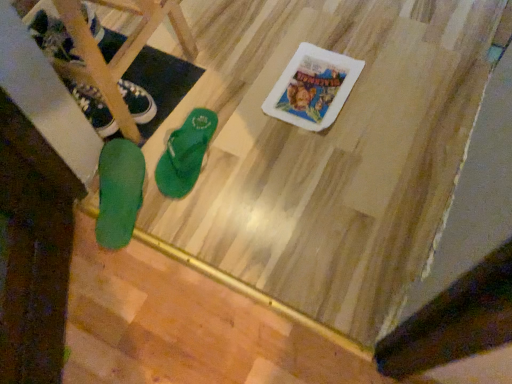
Question: Is green rubber flip-flop at lower left, the second footwear when ordered from right to left, turned away from green rubber flip-flop at lower left, which appears as the first footwear when viewed from the left?

Choices:
 (A) no
 (B) yes

Answer: (A)

Question: From the image's perspective, is green rubber flip-flop at lower left, the second footwear when ordered from right to left, over green rubber flip-flop at lower left, which appears as the first footwear when viewed from the left?

Choices:
 (A) no
 (B) yes

Answer: (A)

Question: Could you tell me if green rubber flip-flop at lower left, the 2th footwear positioned from the left, is facing green rubber flip-flop at lower left, which appears as the first footwear when viewed from the left?

Choices:
 (A) yes
 (B) no

Answer: (A)

Question: Is green rubber flip-flop at lower left, the 2th footwear positioned from the left, behind green rubber flip-flop at lower left, which appears as the first footwear when viewed from the left?

Choices:
 (A) yes
 (B) no

Answer: (B)

Question: Does green rubber flip-flop at lower left, the 2th footwear positioned from the left, come in front of green rubber flip-flop at lower left, which appears as the first footwear when viewed from the left?

Choices:
 (A) no
 (B) yes

Answer: (B)

Question: From a real-world perspective, is green rubber flip-flop at lower left, the 2th footwear positioned from the left, above or below green rubber flip-flop at center, marked as the first footwear in a right-to-left arrangement?

Choices:
 (A) below
 (B) above

Answer: (B)

Question: In terms of width, does green rubber flip-flop at lower left, the 2th footwear positioned from the left, look wider or thinner when compared to green rubber flip-flop at center, the third footwear from the left?

Choices:
 (A) thin
 (B) wide

Answer: (B)

Question: In terms of size, does green rubber flip-flop at lower left, the 2th footwear positioned from the left, appear bigger or smaller than green rubber flip-flop at center, the third footwear from the left?

Choices:
 (A) small
 (B) big

Answer: (B)

Question: Is point (128, 175) positioned closer to the camera than point (205, 145)?

Choices:
 (A) farther
 (B) closer

Answer: (B)

Question: Considering the positions of green rubber flip-flop at center, marked as the first footwear in a right-to-left arrangement, and green rubber flip-flop at lower left, which appears as the first footwear when viewed from the left, in the image, is green rubber flip-flop at center, marked as the first footwear in a right-to-left arrangement, taller or shorter than green rubber flip-flop at lower left, which appears as the first footwear when viewed from the left,?

Choices:
 (A) short
 (B) tall

Answer: (A)

Question: Is green rubber flip-flop at center, the third footwear from the left, to the left or to the right of green rubber flip-flop at lower left, the 3th footwear when ordered from right to left, in the image?

Choices:
 (A) left
 (B) right

Answer: (B)

Question: From the image's perspective, is green rubber flip-flop at center, marked as the first footwear in a right-to-left arrangement, above or below green rubber flip-flop at lower left, the 3th footwear when ordered from right to left?

Choices:
 (A) below
 (B) above

Answer: (A)

Question: Looking at their shapes, would you say green rubber flip-flop at center, the third footwear from the left, is wider or thinner than green rubber flip-flop at lower left, the 3th footwear when ordered from right to left?

Choices:
 (A) wide
 (B) thin

Answer: (A)

Question: Based on their sizes in the image, would you say green rubber flip-flop at lower left, the second footwear when ordered from right to left, is bigger or smaller than green rubber flip-flop at lower left, which appears as the first footwear when viewed from the left?

Choices:
 (A) big
 (B) small

Answer: (A)

Question: Is green rubber flip-flop at lower left, the 2th footwear positioned from the left, in front of or behind green rubber flip-flop at lower left, the 3th footwear when ordered from right to left, in the image?

Choices:
 (A) front
 (B) behind

Answer: (A)